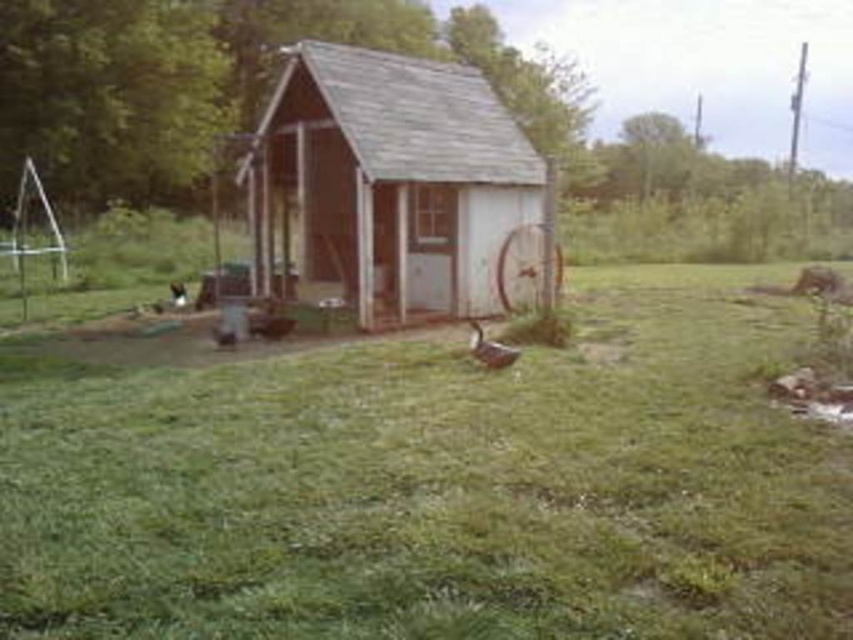
You are standing at the entrance of the rustic wooden structure and want to place a new flowerpot in the green grass at center. Based on the coordinates provided, can you determine the exact position where the flowerpot should be placed?

The green grass at center is located at point [439,484], so the flowerpot should be placed at those coordinates.

You are standing in front of the wooden shed at center and the brown matte duck at center. Which object is higher in elevation?

The wooden shed at center is higher in elevation than the brown matte duck at center because the wooden shed at center is above brown matte duck at center.